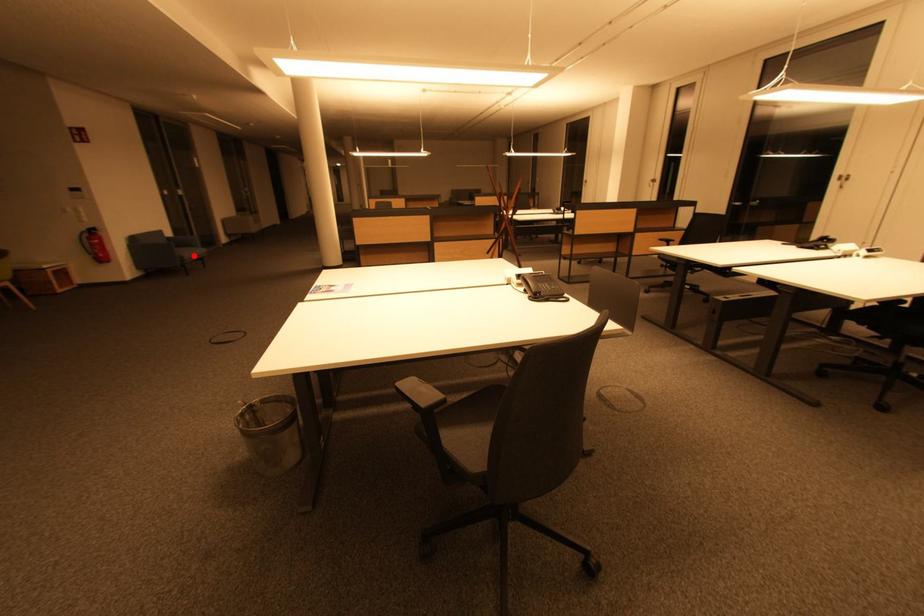
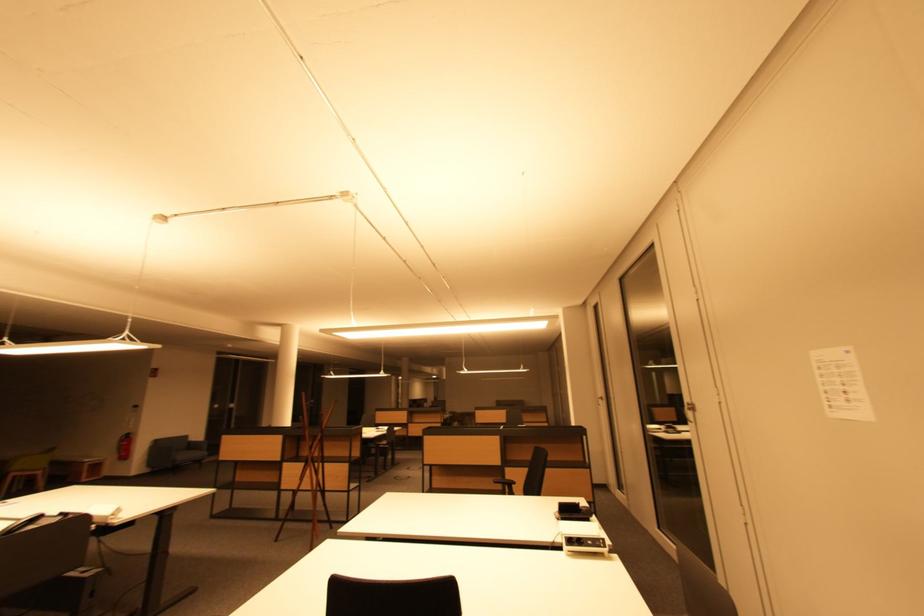
Question: A red point is marked in image1. In image2, is the corresponding 3D point closer to the camera or farther? Reply with the corresponding letter.

Choices:
 (A) The corresponding 3D point is closer.
 (B) The corresponding 3D point is farther.

Answer: (B)